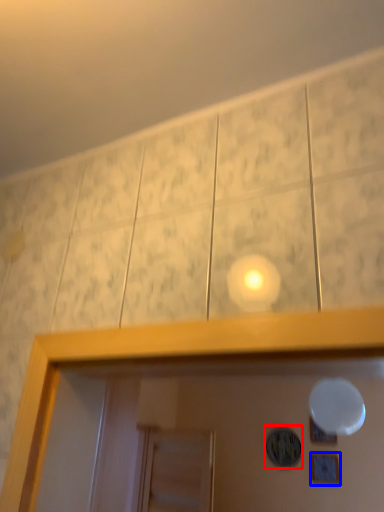
Question: Among these objects, which one is farthest to the camera, dot (highlighted by a red box) or picture frame (highlighted by a blue box)?

Choices:
 (A) dot
 (B) picture frame

Answer: (A)